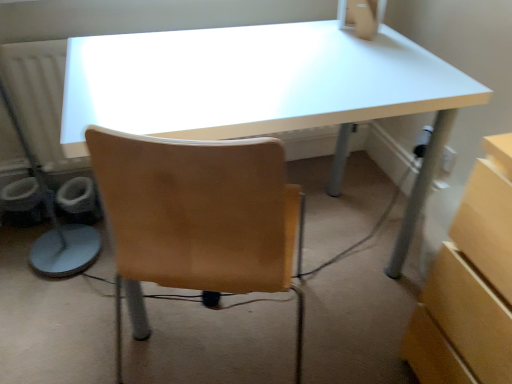
At what (x,y) coordinates should I click in order to perform the action: click on vacant space in front of matte beige desktop computer at upper center. Please return your answer as a coordinate pair (x, y). The height and width of the screenshot is (384, 512). Looking at the image, I should click on (367, 58).